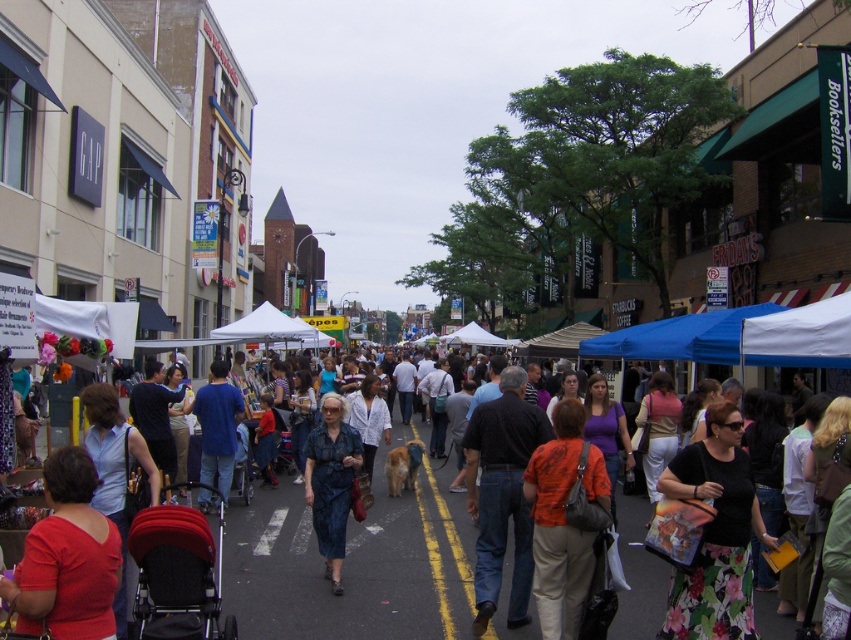
Question: Is matte red blouse at center to the left of red fabric stroller at lower left from the viewer's perspective?

Choices:
 (A) yes
 (B) no

Answer: (A)

Question: Which of the following is the closest to the observer?

Choices:
 (A) (107, 568)
 (B) (201, 637)

Answer: (A)

Question: Is matte black stroller at center wider than blue cotton shirt at center?

Choices:
 (A) no
 (B) yes

Answer: (B)

Question: From the image, what is the correct spatial relationship of orange fabric shirt at center in relation to blue denim dress at center?

Choices:
 (A) left
 (B) right

Answer: (B)

Question: Considering the real-world distances, which object is closest to the blue cotton shirt at center?

Choices:
 (A) orange fabric shirt at center
 (B) red fabric stroller at lower left
 (C) matte red blouse at center

Answer: (B)

Question: Among these points, which one is farthest from the camera?

Choices:
 (A) (20, 545)
 (B) (173, 618)
 (C) (98, 608)
 (D) (671, 616)

Answer: (A)